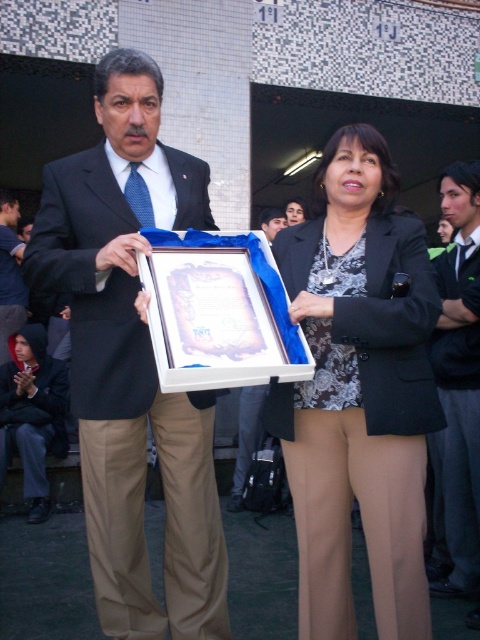
You are attending a formal event and notice two black items in the image. The first is the matte black suit at left, and the second is the matte black jacket at center. Which of these items is taller?

The matte black suit at left is taller than the matte black jacket at center.

You are an event photographer who needs to adjust the lighting to ensure both the matte black blazer at center and the matte black suit at left are evenly lit. Based on their positions, which one might require more light adjustment?

The matte black blazer at center is below the matte black suit at left, so the blazer might be in a shadowed area and require more light adjustment to balance the lighting between the two.

You are attending a formal event and notice two individuals presenting an award. One is wearing a matte black suit at center and the other a dark green fabric business suit at right. Based on their positions, which person is standing to the left of the other?

The matte black suit at center is to the left of dark green fabric business suit at right.